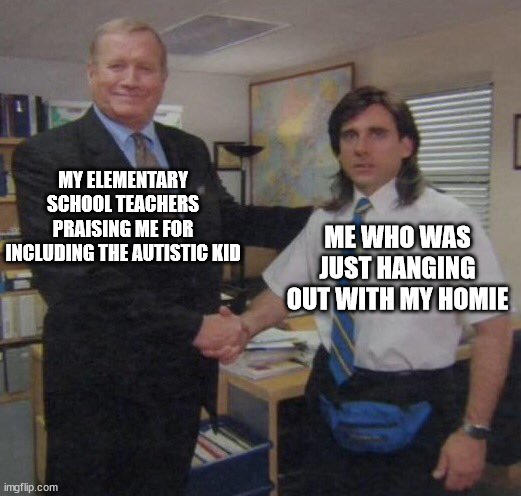
Where is `ceiling`? The width and height of the screenshot is (521, 496). ceiling is located at coordinates (253, 56).